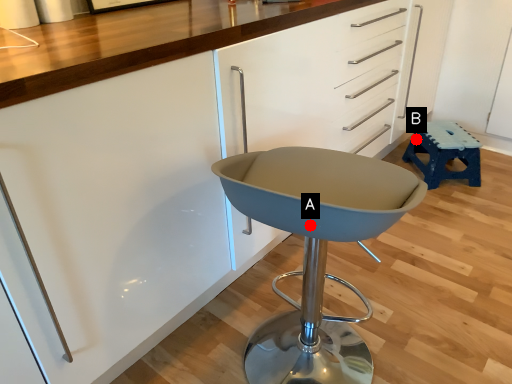
Question: Two points are circled on the image, labeled by A and B beside each circle. Which point is closer to the camera?

Choices:
 (A) A is closer
 (B) B is closer

Answer: (A)